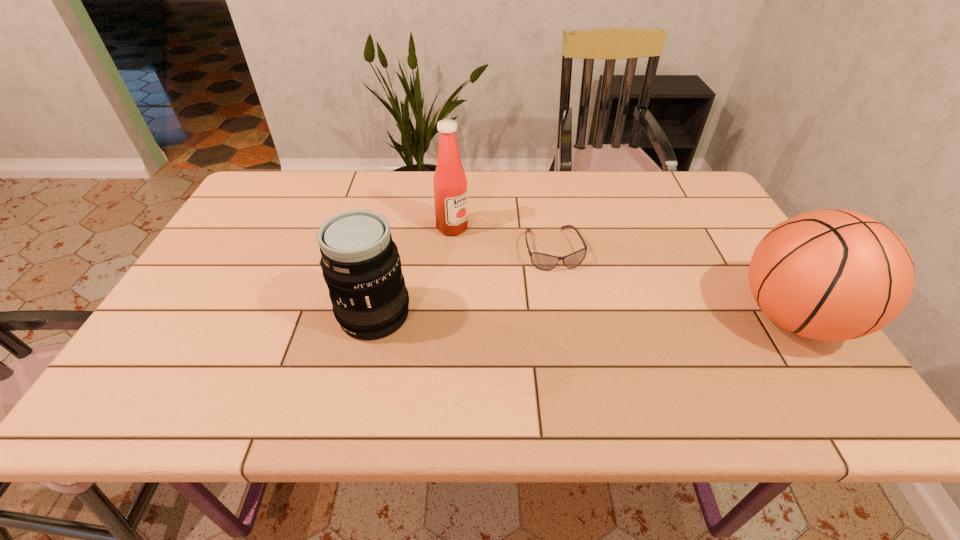
The height and width of the screenshot is (540, 960). In order to click on vacant area situated on the lenses of the sunglasses in this screenshot , I will do `click(590, 350)`.

Where is `free space located on the lenses of the sunglasses`? The width and height of the screenshot is (960, 540). free space located on the lenses of the sunglasses is located at coordinates (573, 303).

Where is `free region located on the lenses of the sunglasses`? The width and height of the screenshot is (960, 540). free region located on the lenses of the sunglasses is located at coordinates (566, 286).

I want to click on telephoto lens that is at the near edge, so click(x=361, y=266).

Identify the location of basketball that is positioned at the near edge. The width and height of the screenshot is (960, 540). (832, 275).

Where is `object that is at the right edge`? The height and width of the screenshot is (540, 960). object that is at the right edge is located at coordinates (832, 275).

The width and height of the screenshot is (960, 540). Identify the location of object at the near right corner. (832, 275).

The image size is (960, 540). Identify the location of free space at the far edge. (630, 179).

You are a GUI agent. You are given a task and a screenshot of the screen. Output one action in this format:
    pyautogui.click(x=<x>, y=<y>)
    Task: Click on the vacant space at the near edge of the desktop
    
    Given the screenshot: What is the action you would take?
    pyautogui.click(x=262, y=356)

The width and height of the screenshot is (960, 540). I want to click on free spot at the far left corner of the desktop, so click(x=267, y=199).